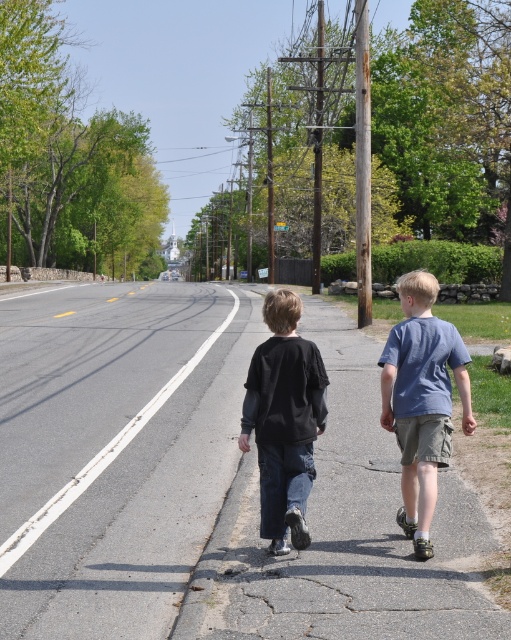
You are standing at point (x=390, y=342) and want to walk to point (x=54, y=451). Based on the scene, is the destination point in front of or behind your current position?

The destination point (x=54, y=451) is behind your current position at (x=390, y=342) because according to the objects description, point (x=54, y=451) is behind point (x=390, y=342).

You are a pedestrian crossing the street and see the gray asphalt road at center and the black matte pants at center. Which object is closer to the left side of the road?

The gray asphalt road at center is to the left of black matte pants at center, so the gray asphalt road at center is closer to the left side of the road.

Consider the image. You are a pedestrian standing on the sidewalk. You see a blue cotton shirt at right and a black matte pants at center. Which one is closer to the road?

The blue cotton shirt at right is closer to the road than the black matte pants at center because it is positioned to the right side of the road.